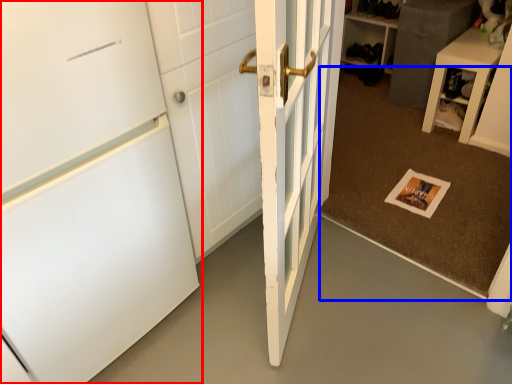
Question: Which object appears closest to the camera in this image, door (highlighted by a red box) or doormat (highlighted by a blue box)?

Choices:
 (A) door
 (B) doormat

Answer: (A)